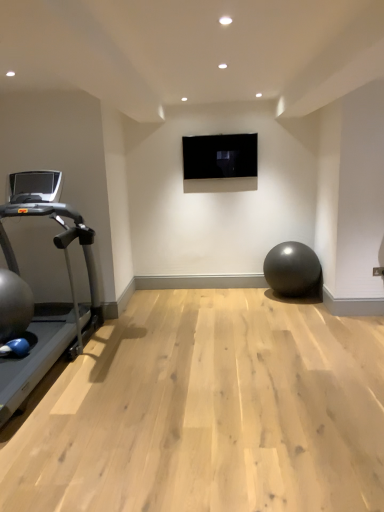
The width and height of the screenshot is (384, 512). Describe the element at coordinates (292, 269) in the screenshot. I see `metallic gray ball at center` at that location.

The image size is (384, 512). I want to click on metallic gray ball at center, so click(292, 269).

Measure the distance between metallic gray ball at center and camera.

The depth of metallic gray ball at center is 15.47 feet.

Locate an element on the screen. Image resolution: width=384 pixels, height=512 pixels. silver metallic treadmill at left is located at coordinates (43, 303).

The width and height of the screenshot is (384, 512). Describe the element at coordinates (43, 303) in the screenshot. I see `silver metallic treadmill at left` at that location.

Identify the location of metallic gray ball at center. The height and width of the screenshot is (512, 384). (292, 269).

Would you say silver metallic treadmill at left is to the left or to the right of metallic gray ball at center in the picture?

silver metallic treadmill at left is to the left of metallic gray ball at center.

Which is in front, silver metallic treadmill at left or metallic gray ball at center?

silver metallic treadmill at left is closer to the camera.

Considering the positions of points (3, 315) and (295, 287), is point (3, 315) farther from camera compared to point (295, 287)?

No, (3, 315) is in front of (295, 287).

From the image's perspective, is silver metallic treadmill at left positioned above or below metallic gray ball at center?

Clearly, from the image's perspective, silver metallic treadmill at left is above metallic gray ball at center.

Based on the photo, from a real-world perspective, is silver metallic treadmill at left positioned over metallic gray ball at center based on gravity?

Yes, from a real-world perspective, silver metallic treadmill at left is on top of metallic gray ball at center.

Does silver metallic treadmill at left have a greater width compared to metallic gray ball at center?

Indeed, silver metallic treadmill at left has a greater width compared to metallic gray ball at center.

Considering the relative sizes of silver metallic treadmill at left and metallic gray ball at center in the image provided, is silver metallic treadmill at left shorter than metallic gray ball at center?

In fact, silver metallic treadmill at left may be taller than metallic gray ball at center.

Looking at this image, does silver metallic treadmill at left have a larger size compared to metallic gray ball at center?

Yes.

In the scene shown: Is metallic gray ball at center a part of silver metallic treadmill at left?

No, metallic gray ball at center is located outside of silver metallic treadmill at left.

Does silver metallic treadmill at left touch metallic gray ball at center?

No.

Is silver metallic treadmill at left oriented away from metallic gray ball at center?

No, metallic gray ball at center is not at the back of silver metallic treadmill at left.

The image size is (384, 512). I want to click on treadmill lying above the metallic gray ball at center (from the image's perspective), so click(x=43, y=303).

Between metallic gray ball at center and silver metallic treadmill at left, which one appears on the left side from the viewer's perspective?

silver metallic treadmill at left.

Is metallic gray ball at center further to the viewer compared to silver metallic treadmill at left?

Yes, it is.

Does point (290, 243) lie behind point (74, 302)?

Yes, point (290, 243) is behind point (74, 302).

From the image's perspective, between metallic gray ball at center and silver metallic treadmill at left, who is located below?

metallic gray ball at center appears lower in the image.

From a real-world perspective, between metallic gray ball at center and silver metallic treadmill at left, who is vertically higher?

silver metallic treadmill at left is physically above.

Does metallic gray ball at center have a greater width compared to silver metallic treadmill at left?

In fact, metallic gray ball at center might be narrower than silver metallic treadmill at left.

Based on the photo, considering the sizes of metallic gray ball at center and silver metallic treadmill at left in the image, is metallic gray ball at center taller or shorter than silver metallic treadmill at left?

Considering their sizes, metallic gray ball at center has less height than silver metallic treadmill at left.

Looking at the image, does metallic gray ball at center seem bigger or smaller compared to silver metallic treadmill at left?

Considering their sizes, metallic gray ball at center takes up less space than silver metallic treadmill at left.

Is metallic gray ball at center surrounding silver metallic treadmill at left?

Definitely not — silver metallic treadmill at left is not inside metallic gray ball at center.

Is metallic gray ball at center far from silver metallic treadmill at left?

Yes, metallic gray ball at center and silver metallic treadmill at left are quite far apart.

Is metallic gray ball at center looking in the opposite direction of silver metallic treadmill at left?

No, metallic gray ball at center is not facing the opposite direction of silver metallic treadmill at left.

Looking at this image, how many degrees apart are the facing directions of metallic gray ball at center and silver metallic treadmill at left?

metallic gray ball at center and silver metallic treadmill at left are facing 89.7 degrees away from each other.

Identify the location of treadmill in front of the metallic gray ball at center. (43, 303).

In the image, there is a metallic gray ball at center. At what (x,y) coordinates should I click in order to perform the action: click on treadmill above it (from the image's perspective). Please return your answer as a coordinate pair (x, y). The width and height of the screenshot is (384, 512). Looking at the image, I should click on (43, 303).

Where is `treadmill above the metallic gray ball at center (from a real-world perspective)`? The height and width of the screenshot is (512, 384). treadmill above the metallic gray ball at center (from a real-world perspective) is located at coordinates [x=43, y=303].